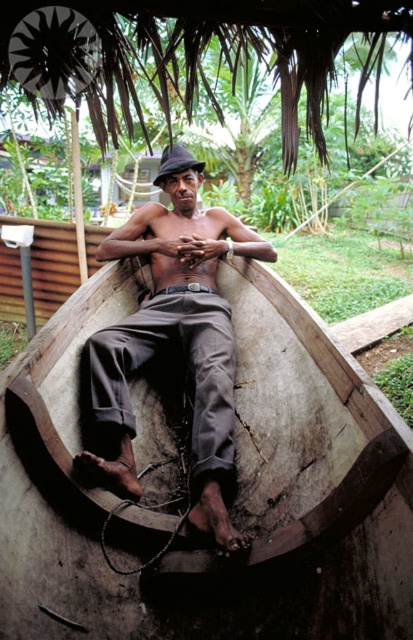
Question: Observing the image, what is the correct spatial positioning of wooden canoe at center in reference to matte brown pants at center?

Choices:
 (A) left
 (B) right

Answer: (B)

Question: Can you confirm if wooden canoe at center is wider than matte brown pants at center?

Choices:
 (A) no
 (B) yes

Answer: (B)

Question: Which point appears farthest from the camera in this image?

Choices:
 (A) (194, 278)
 (B) (135, 636)

Answer: (A)

Question: Which object appears closest to the camera in this image?

Choices:
 (A) wooden canoe at center
 (B) matte brown pants at center

Answer: (A)

Question: Does wooden canoe at center appear on the right side of matte brown pants at center?

Choices:
 (A) yes
 (B) no

Answer: (A)